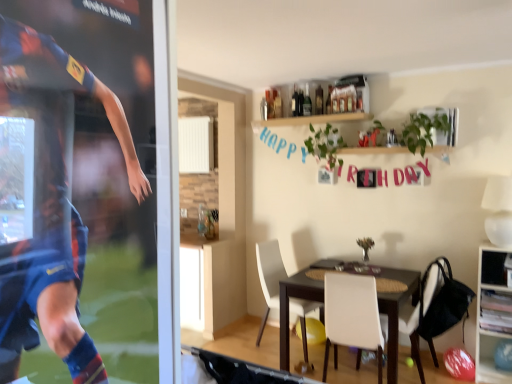
Question: In the image, is white matte chair at center, the 3th chair in the right-to-left sequence, positioned in front of or behind wooden cabinet at right?

Choices:
 (A) front
 (B) behind

Answer: (B)

Question: From a real-world perspective, is white matte chair at center, placed as the 1th chair when sorted from left to right, physically located above or below wooden cabinet at right?

Choices:
 (A) above
 (B) below

Answer: (B)

Question: Which of these objects is positioned farthest from the white matte chair at center, which appears as the 2th chair when viewed from the right?

Choices:
 (A) wooden cabinet at right
 (B) white matte chair at center, the 1th chair when ordered from right to left
 (C) white matte chair at center, placed as the 1th chair when sorted from left to right
 (D) dark brown wooden table at center

Answer: (A)

Question: Estimate the real-world distances between objects in this image. Which object is closer to the dark brown wooden table at center?

Choices:
 (A) white matte chair at center, which appears as the 2th chair when viewed from the right
 (B) white matte chair at center, the 3th chair in the right-to-left sequence
 (C) white matte chair at center, the 1th chair when ordered from right to left
 (D) wooden cabinet at right

Answer: (C)